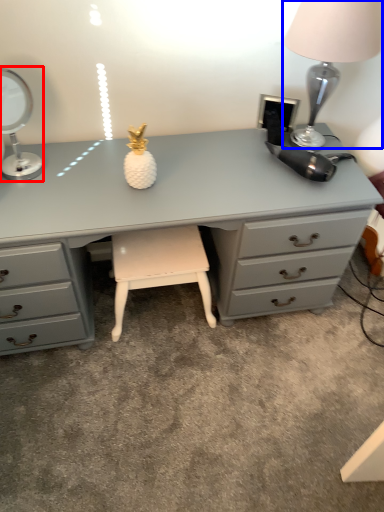
Question: Which point is further to the camera, table lamp (highlighted by a red box) or table lamp (highlighted by a blue box)?

Choices:
 (A) table lamp
 (B) table lamp

Answer: (A)